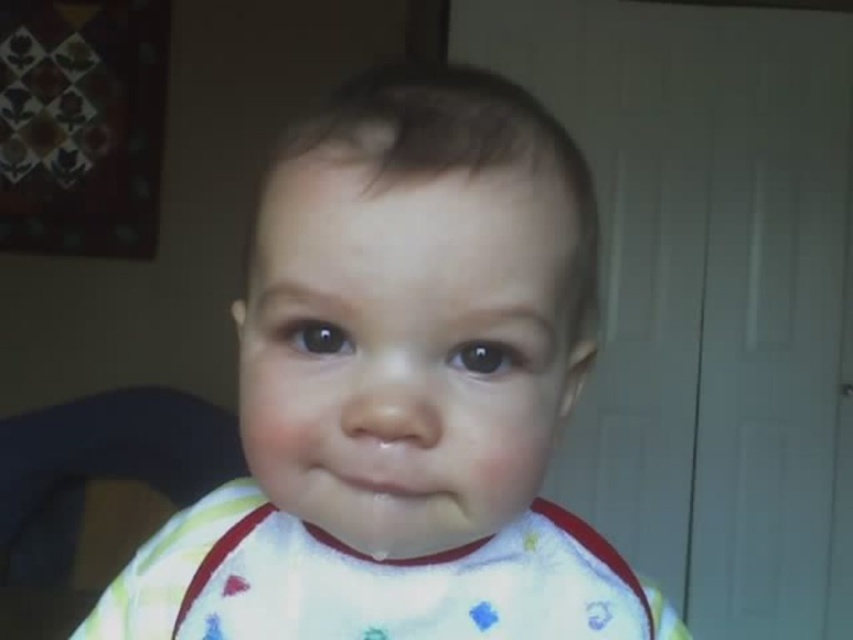
In the scene shown: You are standing in the room where the baby is. You see two points marked in the scene. The first point is at coordinates point [442,588] and the second point is at point [51,632]. Which point is closer to you?

Point [442,588] is in front of point [51,632], so the first point is closer to you.

You are a photographer trying to capture a close up of the baby in the image. You need to focus on the white soft bib at center and the white fabric bib at center. Can you fit both of them in your camera frame if the minimum distance your camera can focus on is 2 inches?

The white soft bib at center and white fabric bib at center are 1.88 inches apart, so yes, the camera can focus on both as the distance between them is less than the 2 inches minimum focus distance.

You are a photographer adjusting the focus on your camera. You notice a point at coordinates (415, 586) in the image. What object is located at that point?

The point at coordinates (415, 586) corresponds to the white fabric bib at center.